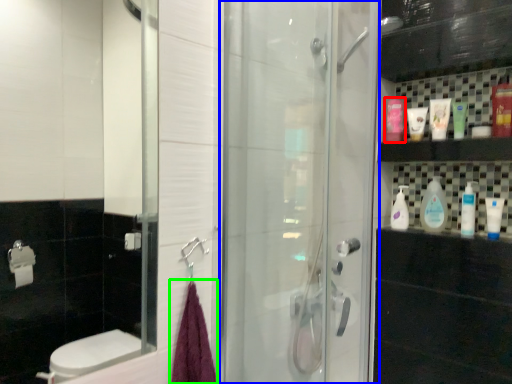
Question: Considering the real-world distances, which object is closest to mouthwash (highlighted by a red box)? screen door (highlighted by a blue box) or bath towel (highlighted by a green box).

Choices:
 (A) screen door
 (B) bath towel

Answer: (A)